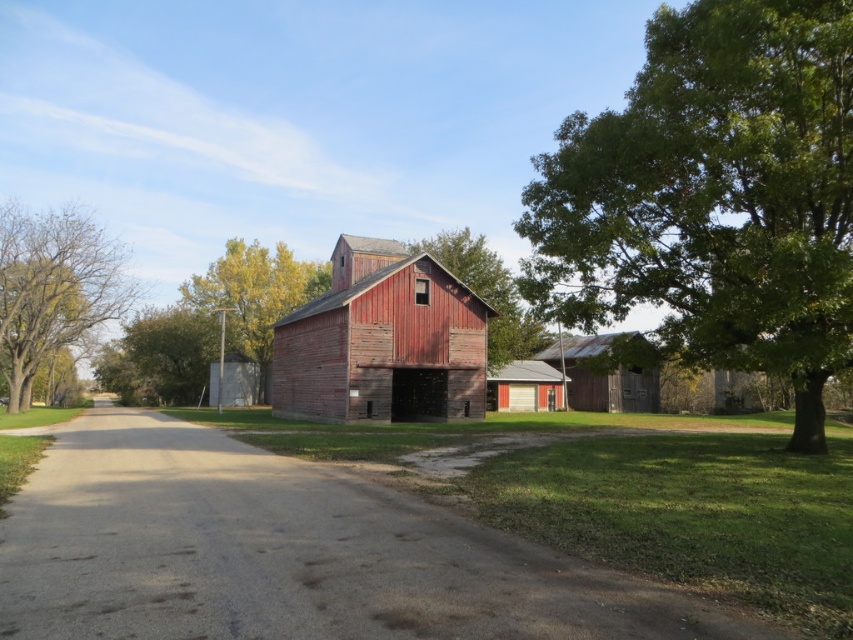
Is green leafy tree at center smaller than green leafy tree at left?

No.

Between green leafy tree at center and green leafy tree at left, which one appears on the right side from the viewer's perspective?

From the viewer's perspective, green leafy tree at center appears more on the right side.

Does point (306, 285) come farther from viewer compared to point (146, 385)?

No, (306, 285) is in front of (146, 385).

The width and height of the screenshot is (853, 640). In order to click on green leafy tree at center in this screenshot , I will do `click(254, 296)`.

What do you see at coordinates (381, 340) in the screenshot? I see `rustic wood barn at center` at bounding box center [381, 340].

Describe the element at coordinates (381, 340) in the screenshot. I see `rustic wood barn at center` at that location.

I want to click on rustic wood barn at center, so click(x=381, y=340).

Is rustic wood barn at center smaller than smooth wooden barn at center?

Correct, rustic wood barn at center occupies less space than smooth wooden barn at center.

Does rustic wood barn at center come behind smooth wooden barn at center?

No, rustic wood barn at center is in front of smooth wooden barn at center.

Who is more forward, (283,412) or (447,266)?

Point (283,412)

At what (x,y) coordinates should I click in order to perform the action: click on rustic wood barn at center. Please return your answer as a coordinate pair (x, y). This screenshot has height=640, width=853. Looking at the image, I should click on (381, 340).